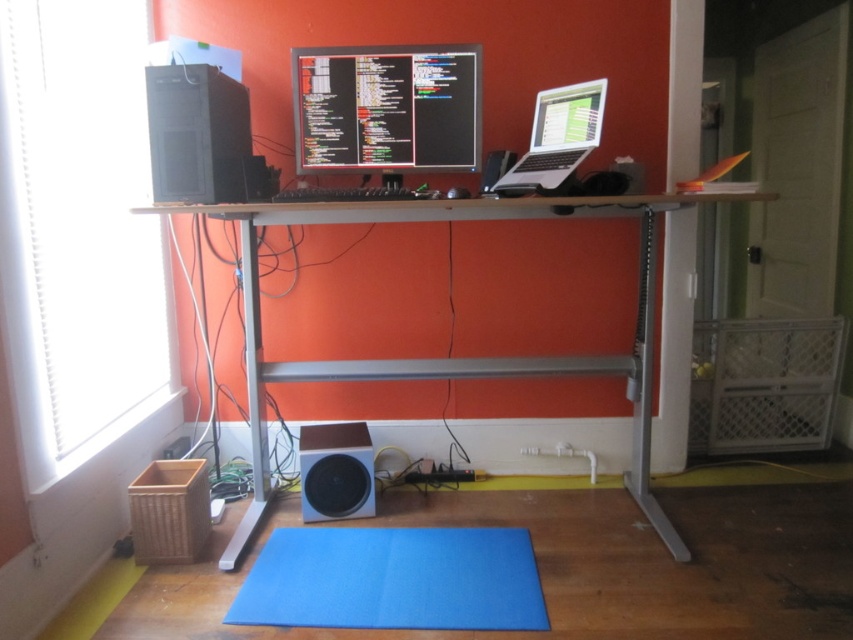
You are setting up a new keyboard on the desk. The keyboard requires a space wider than the black glossy monitor at center. Can the blue felt mat at lower center accommodate the keyboard?

The blue felt mat at lower center is wider than the black glossy monitor at center, so yes, the keyboard can be placed on the blue felt mat at lower center as it has sufficient width.

You are organizing cables for a tech setup. You have a silver metallic laptop at upper right and a white matte speaker at lower center. Which object is positioned higher in the image?

The silver metallic laptop at upper right is positioned higher than the white matte speaker at lower center.

You are organizing cables for a tech setup and need to connect a new device to either the black glossy monitor at center or the silver metallic laptop at upper right. Which device is closer to you, and thus easier to reach?

The black glossy monitor at center is closer to you than the silver metallic laptop at upper right, so it is easier to reach.